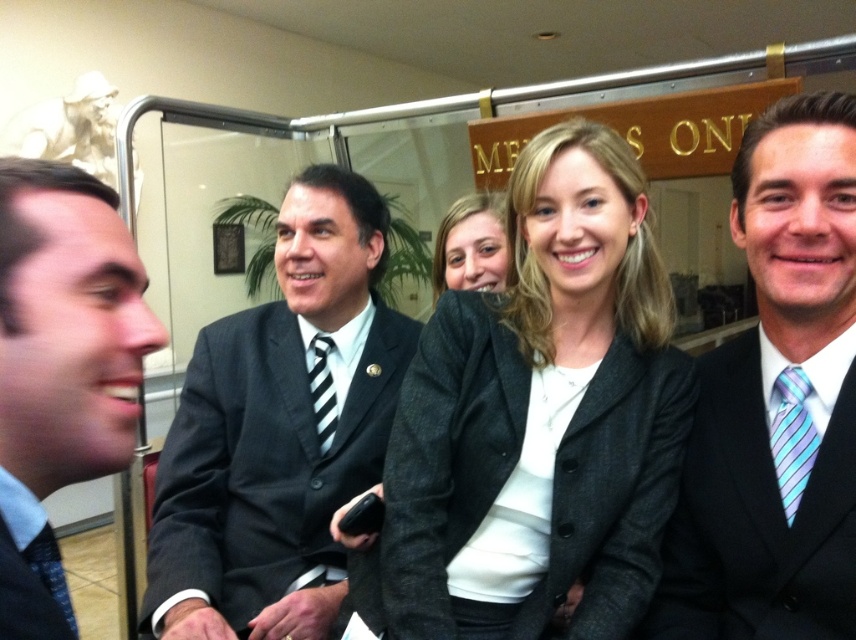
Based on the photo, is striped silk tie at right taller than black striped tie at center?

No.

Looking at this image, is striped silk tie at right to the right of black striped tie at center from the viewer's perspective?

Indeed, striped silk tie at right is positioned on the right side of black striped tie at center.

Which is in front, point (771, 400) or point (324, 449)?

Positioned in front is point (771, 400).

Find the location of a particular element. striped silk tie at right is located at coordinates (792, 436).

Which is in front, point (306, 369) or point (800, 310)?

Point (800, 310) is more forward.

Does point (342, 557) lie in front of point (807, 144)?

No.

What are the coordinates of `dark gray suit at center` in the screenshot? It's located at (278, 429).

Where is `dark gray suit at center`? This screenshot has width=856, height=640. dark gray suit at center is located at coordinates (278, 429).

Which is more to the left, matte gray blazer at center or black striped tie at center?

black striped tie at center

Can you confirm if matte gray blazer at center is taller than black striped tie at center?

Yes.

Find the location of a particular element. The image size is (856, 640). matte gray blazer at center is located at coordinates (471, 244).